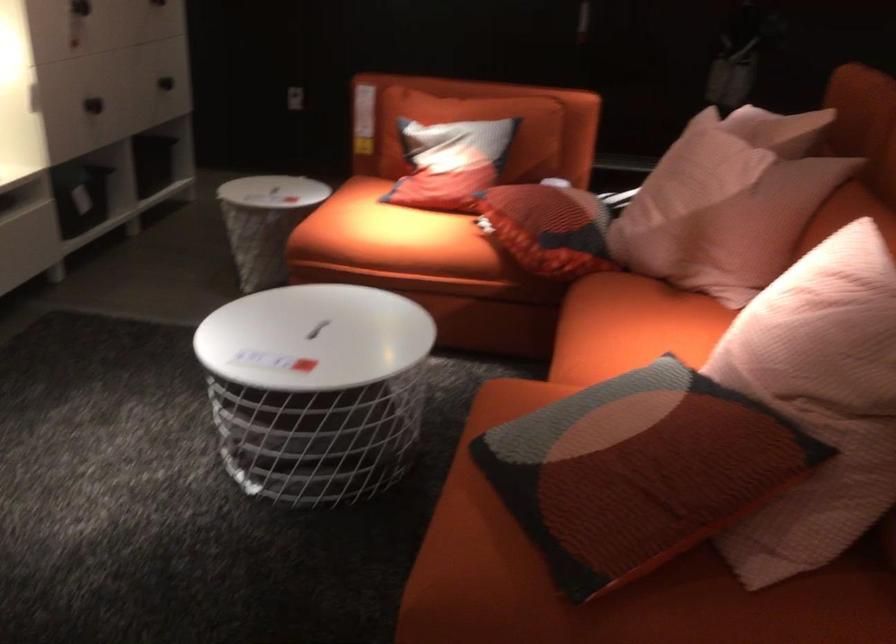
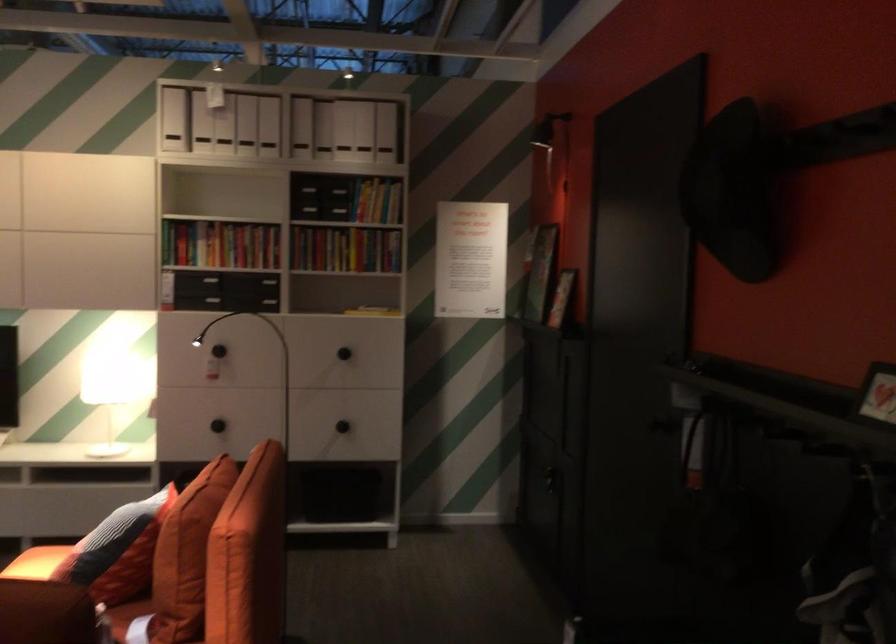
Locate, in the second image, the point that corresponds to point 124,96 in the first image.

(218, 426)